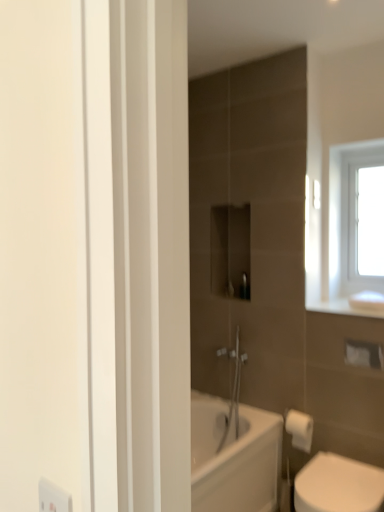
I want to click on vacant area on top of white glossy toilet at lower right (from a real-world perspective), so click(x=337, y=486).